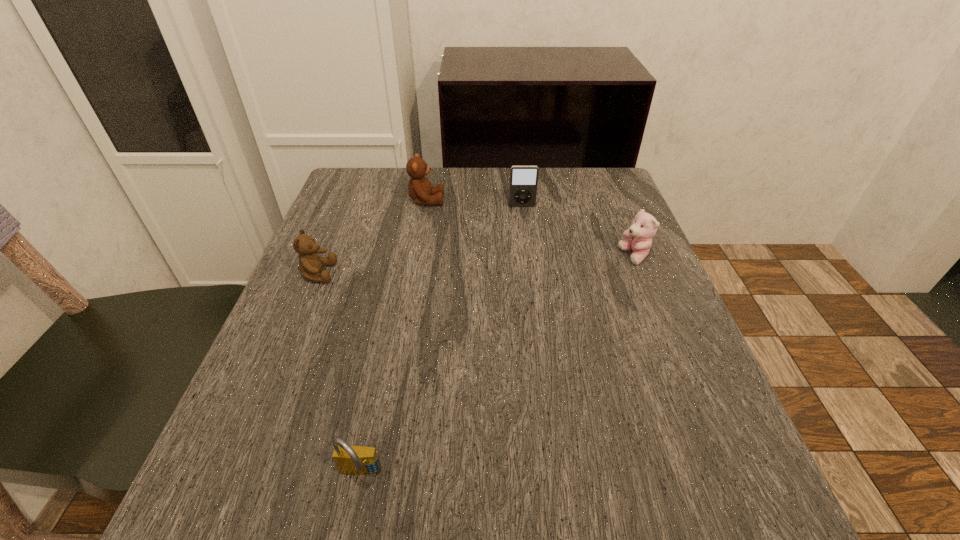
Where is `free point between the leftmost teddy bear and the rightmost teddy bear`? free point between the leftmost teddy bear and the rightmost teddy bear is located at coordinates (476, 265).

What are the coordinates of `free space between the rightmost object and the second teddy bear from left to right` in the screenshot? It's located at (530, 228).

Locate an element on the screen. Image resolution: width=960 pixels, height=540 pixels. free spot between the farthest teddy bear and the nearest object is located at coordinates (394, 338).

Locate an element on the screen. This screenshot has height=540, width=960. vacant space in between the second object from right to left and the farthest teddy bear is located at coordinates (474, 204).

Identify which object is located as the third nearest to the second object from right to left. Please provide its 2D coordinates. Your answer should be formatted as a tuple, i.e. [(x, y)], where the tuple contains the x and y coordinates of a point satisfying the conditions above.

[(310, 264)]

Choose which object is the fourth nearest neighbor to the rightmost object. Please provide its 2D coordinates. Your answer should be formatted as a tuple, i.e. [(x, y)], where the tuple contains the x and y coordinates of a point satisfying the conditions above.

[(356, 460)]

At what (x,y) coordinates should I click in order to perform the action: click on teddy bear that is the third closest to the second object from right to left. Please return your answer as a coordinate pair (x, y). This screenshot has height=540, width=960. Looking at the image, I should click on (x=310, y=264).

Identify which teddy bear is the second closest to the leftmost object. Please provide its 2D coordinates. Your answer should be formatted as a tuple, i.e. [(x, y)], where the tuple contains the x and y coordinates of a point satisfying the conditions above.

[(644, 227)]

The image size is (960, 540). I want to click on vacant space that satisfies the following two spatial constraints: 1. at the face of the rightmost teddy bear; 2. on the side with the combination dials of the padlock, so click(724, 475).

What are the coordinates of `free spot that satisfies the following two spatial constraints: 1. on the face of the second teddy bear from right to left; 2. on the side with the combination dials of the nearest object` in the screenshot? It's located at (380, 475).